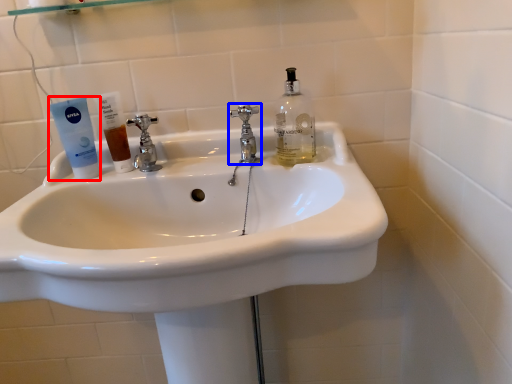
Question: Which of the following is the closest to the observer, toothpaste (highlighted by a red box) or tap (highlighted by a blue box)?

Choices:
 (A) toothpaste
 (B) tap

Answer: (A)